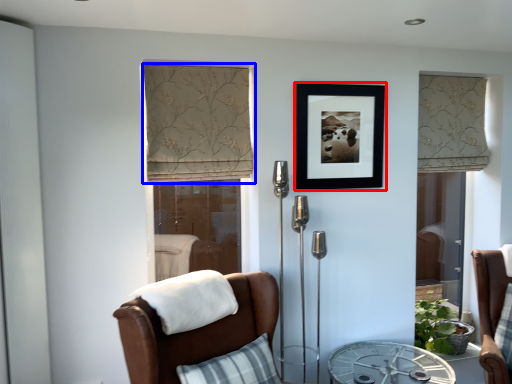
Question: Which object is further to the camera taking this photo, picture frame (highlighted by a red box) or curtain (highlighted by a blue box)?

Choices:
 (A) picture frame
 (B) curtain

Answer: (A)